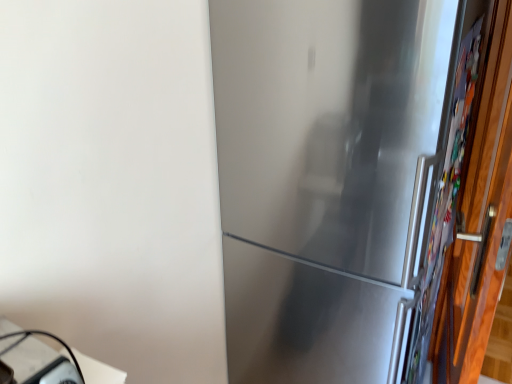
Question: Is satin silver refrigerator at center spatially inside white glossy table at lower left, or outside of it?

Choices:
 (A) outside
 (B) inside

Answer: (A)

Question: In the image, is satin silver refrigerator at center on the left side or the right side of white glossy table at lower left?

Choices:
 (A) right
 (B) left

Answer: (A)

Question: Estimate the real-world distances between objects in this image. Which object is closer to the wooden door at right?

Choices:
 (A) white glossy table at lower left
 (B) satin silver refrigerator at center

Answer: (B)

Question: Which object is positioned farthest from the satin silver refrigerator at center?

Choices:
 (A) white glossy table at lower left
 (B) wooden door at right

Answer: (A)